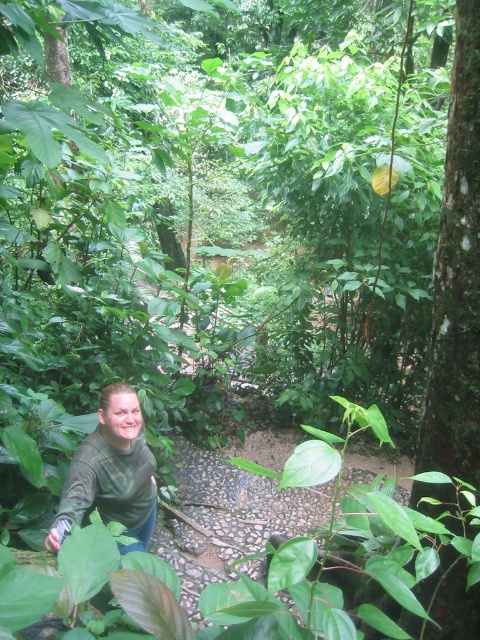
Question: Does green rough bark tree at right have a lesser width compared to green matte shirt at lower left?

Choices:
 (A) no
 (B) yes

Answer: (B)

Question: Is green rough bark tree at right to the left of green matte shirt at lower left from the viewer's perspective?

Choices:
 (A) no
 (B) yes

Answer: (A)

Question: Can you confirm if green rough bark tree at right is thinner than green matte shirt at lower left?

Choices:
 (A) no
 (B) yes

Answer: (B)

Question: Which point is closer to the camera taking this photo?

Choices:
 (A) (453, 156)
 (B) (92, 468)

Answer: (A)